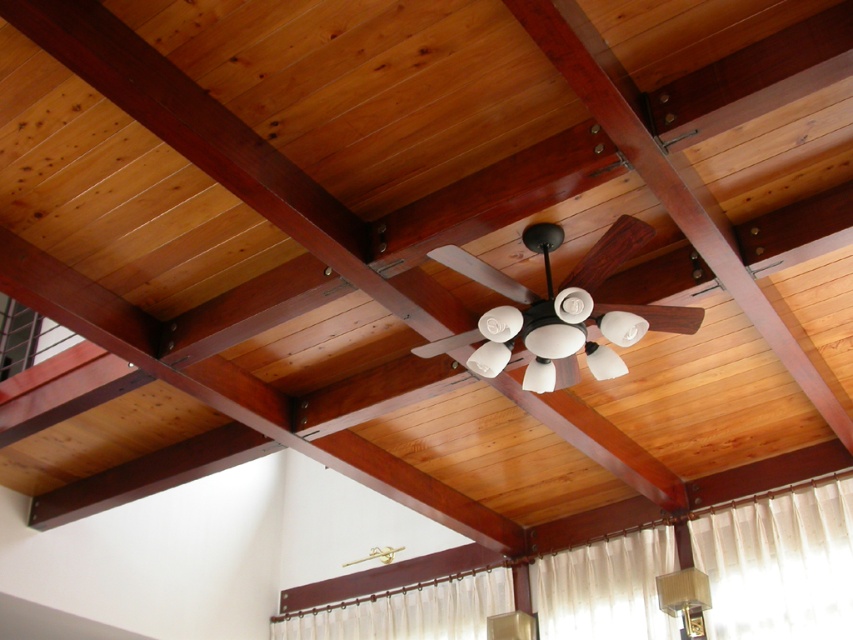
Question: Which point is closer to the camera taking this photo?

Choices:
 (A) (485, 570)
 (B) (548, 592)
 (C) (663, 577)
 (D) (584, 266)

Answer: (D)

Question: Which of the following is the closest to the observer?

Choices:
 (A) (293, 634)
 (B) (491, 596)
 (C) (693, 608)

Answer: (C)

Question: Where is white sheer curtain at lower right located in relation to white matte fan at center in the image?

Choices:
 (A) right
 (B) left

Answer: (A)

Question: Is white sheer curtain at lower right to the left of white matte fan at center from the viewer's perspective?

Choices:
 (A) yes
 (B) no

Answer: (B)

Question: Which of the following is the farthest from the observer?

Choices:
 (A) matte white lampshade at lower right
 (B) white sheer curtain at lower center
 (C) white matte fan at center
 (D) white sheer curtain at lower right

Answer: (B)

Question: Is white sheer curtain at lower right to the right of white matte fan at center from the viewer's perspective?

Choices:
 (A) yes
 (B) no

Answer: (A)